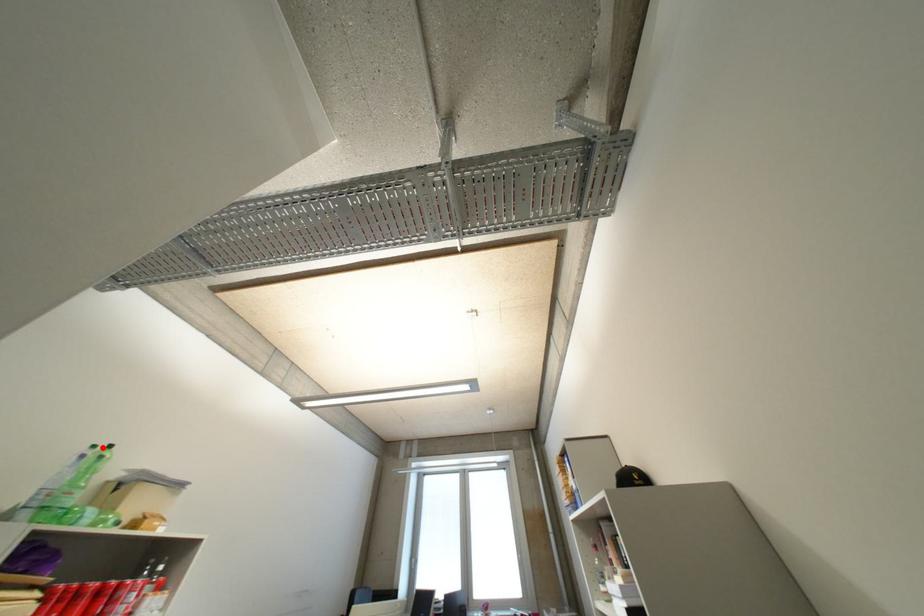
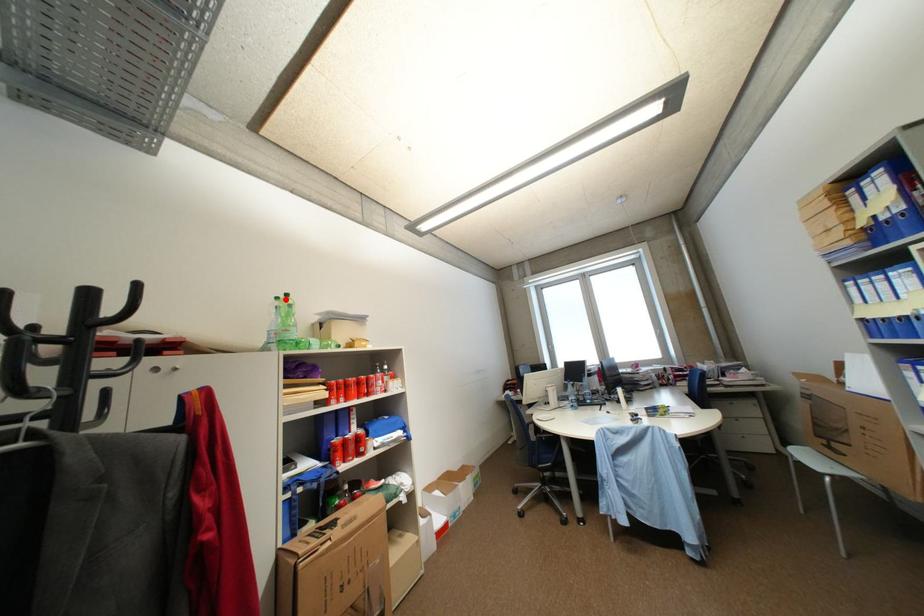
I am providing you with two images of the same scene from different viewpoints. A red point is marked on the first image and another point is marked on the second image. Does the point marked in image1 correspond to the same location as the one in image2?

Yes